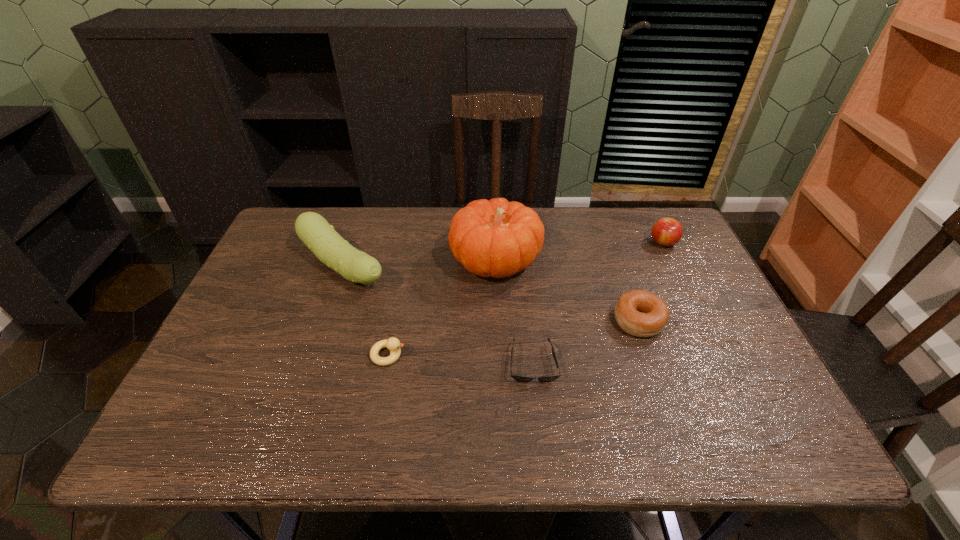
The height and width of the screenshot is (540, 960). Identify the location of vacant space that's between the cucumber and the pumpkin. (420, 265).

Locate an element on the screen. free spot between the fifth object from left to right and the third tallest object is located at coordinates (651, 282).

This screenshot has height=540, width=960. I want to click on free space between the third tallest object and the fourth farthest object, so click(x=651, y=282).

Locate an element on the screen. Image resolution: width=960 pixels, height=540 pixels. vacant space that's between the third nearest object and the sunglasses is located at coordinates (586, 342).

Where is `free space between the cucumber and the duckling`? free space between the cucumber and the duckling is located at coordinates (366, 311).

Locate an element on the screen. The height and width of the screenshot is (540, 960). empty space that is in between the shortest object and the duckling is located at coordinates (461, 359).

This screenshot has height=540, width=960. I want to click on object that stands as the second closest to the shortest object, so click(497, 238).

Identify which object is located as the nearest to the rightmost object. Please provide its 2D coordinates. Your answer should be formatted as a tuple, i.e. [(x, y)], where the tuple contains the x and y coordinates of a point satisfying the conditions above.

[(640, 313)]

The height and width of the screenshot is (540, 960). In order to click on free spot that satisfies the following two spatial constraints: 1. on the front side of the rightmost object; 2. at the beak of the duckling in this screenshot , I will do `click(717, 355)`.

Identify the location of free location that satisfies the following two spatial constraints: 1. on the front side of the bagel; 2. on the left side of the tallest object. This screenshot has height=540, width=960. tap(497, 321).